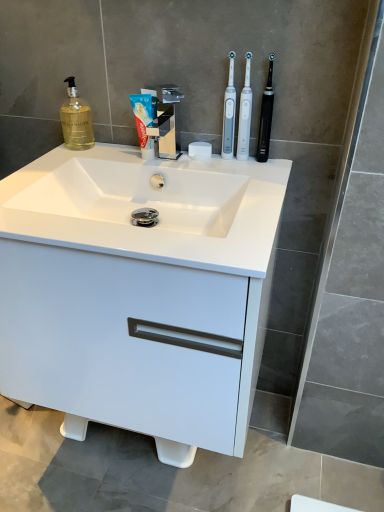
Identify the location of vacant space in front of white matte soap at center. (216, 174).